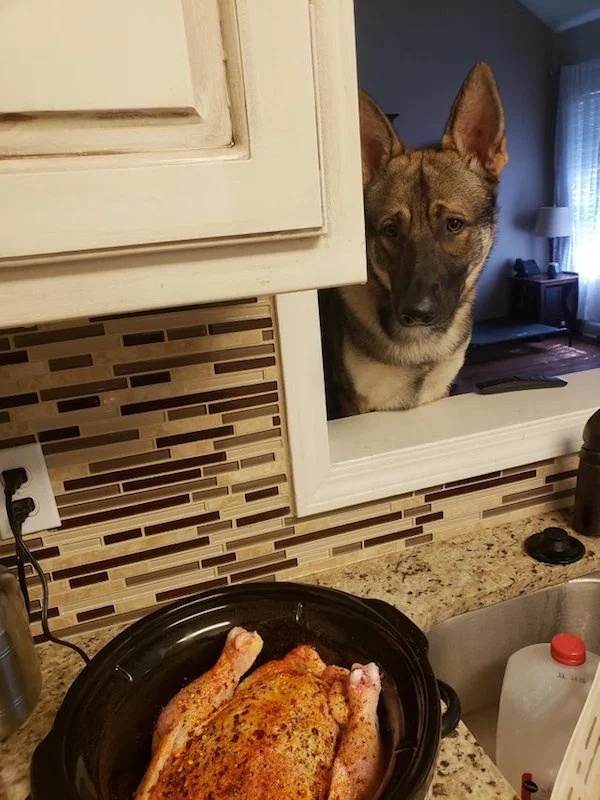
You are a GUI agent. You are given a task and a screenshot of the screen. Output one action in this format:
    pyautogui.click(x=<x>, y=<y>)
    Task: Click on the empty milk jug in sink
    The width and height of the screenshot is (600, 800).
    Given the screenshot: What is the action you would take?
    pyautogui.click(x=536, y=725)